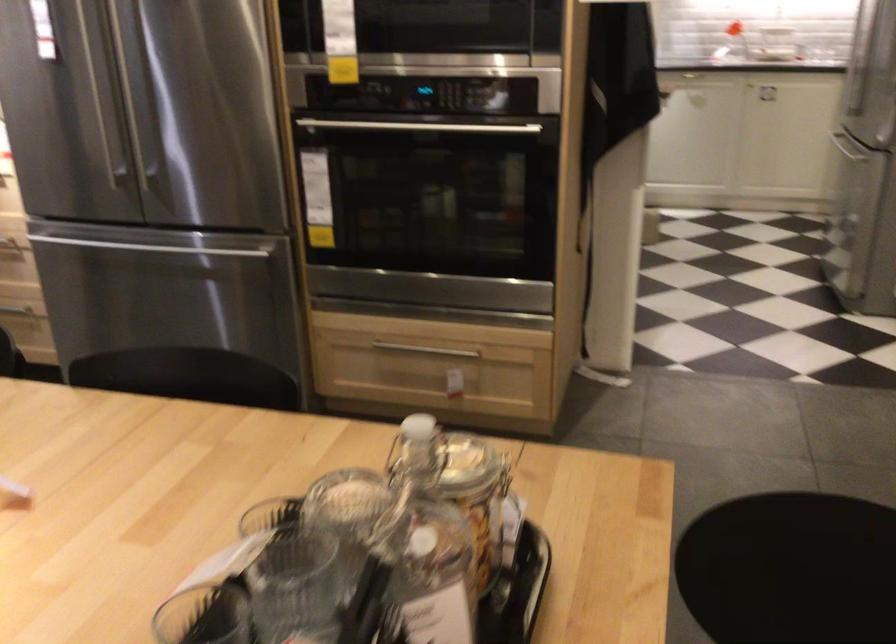
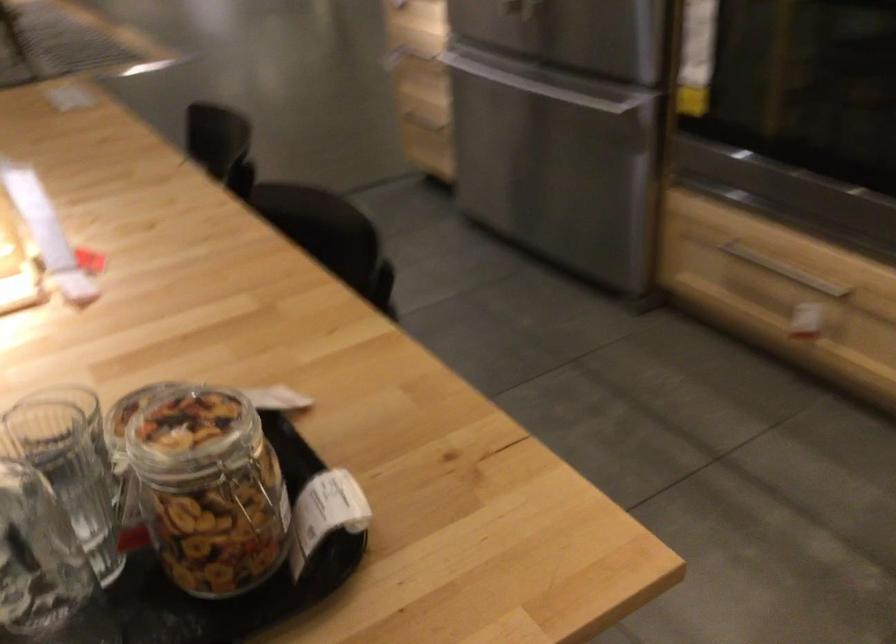
Question: I am providing you with two images of the same scene from different viewpoints. After the viewpoint changes to image2, which objects are now occluded?

Choices:
 (A) cabinet drawer handle
 (B) glass jar
 (C) freezer drawer handle
 (D) none of these

Answer: (D)